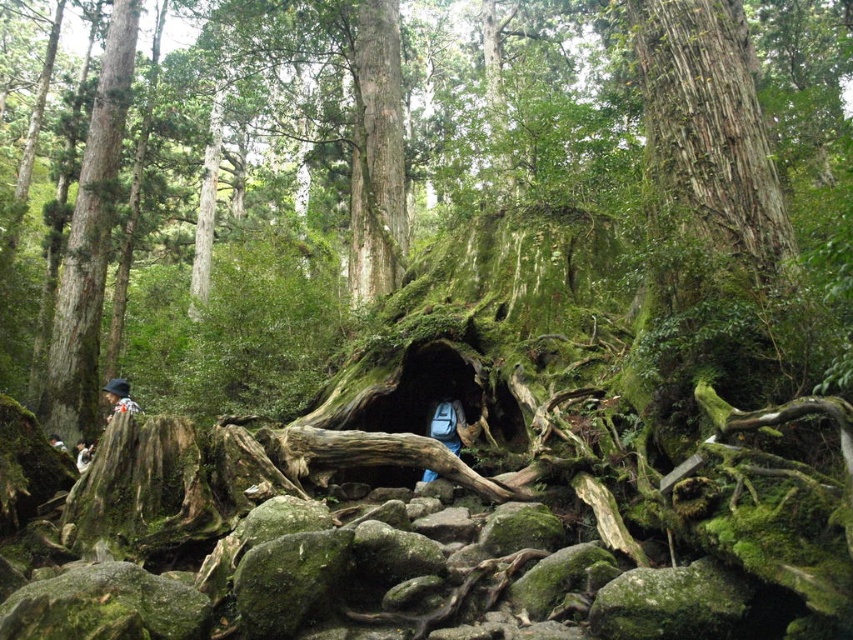
Is green mossy bark tree trunk at center shorter than light brown leather jacket at lower left?

Correct, green mossy bark tree trunk at center is not as tall as light brown leather jacket at lower left.

Who is more distant from viewer, (380,195) or (62,451)?

Positioned behind is point (380,195).

The image size is (853, 640). What are the coordinates of `green mossy bark tree trunk at center` in the screenshot? It's located at (376, 154).

The width and height of the screenshot is (853, 640). In order to click on green mossy bark tree trunk at center in this screenshot , I will do `click(376, 154)`.

Is blue fabric backpack at center to the left of camouflage jacket at left from the viewer's perspective?

No, blue fabric backpack at center is not to the left of camouflage jacket at left.

You are a GUI agent. You are given a task and a screenshot of the screen. Output one action in this format:
    pyautogui.click(x=<x>, y=<y>)
    Task: Click on the blue fabric backpack at center
    
    Given the screenshot: What is the action you would take?
    pyautogui.click(x=447, y=422)

Can you confirm if green mossy bark tree trunk at center is positioned below blue fabric backpack at center?

No.

Is green mossy bark tree trunk at center in front of blue fabric backpack at center?

No, it is behind blue fabric backpack at center.

Describe the element at coordinates (376, 154) in the screenshot. This screenshot has height=640, width=853. I see `green mossy bark tree trunk at center` at that location.

Where is `green mossy bark tree trunk at center`? green mossy bark tree trunk at center is located at coordinates (376, 154).